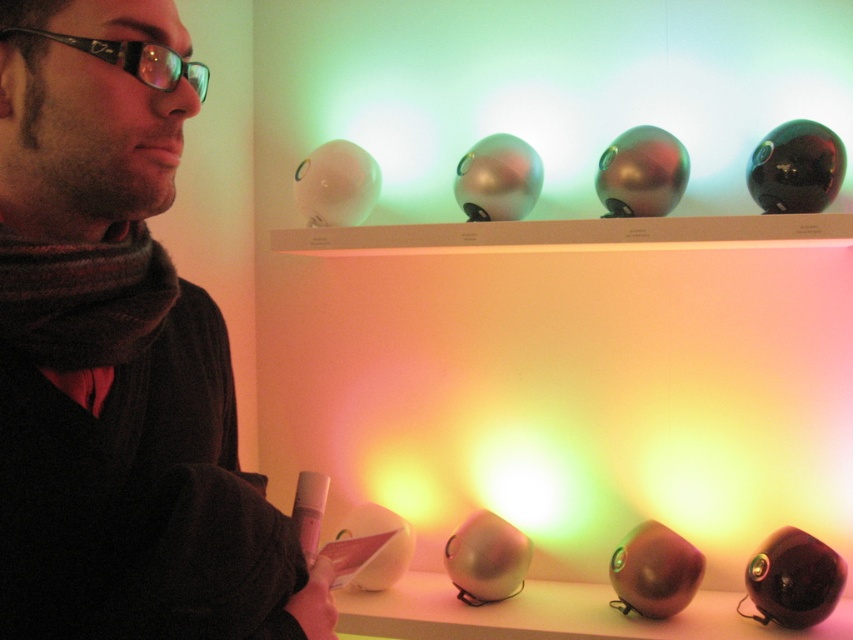
You are an artist trying to sketch the man in the image. Which object, the matte black scarf at left or the black plastic glasses at upper left, would you need to draw first if you follow the rule of drawing larger objects before smaller ones?

The matte black scarf at left is larger in size than the black plastic glasses at upper left, so you should draw the matte black scarf at left first.

You are an artist trying to sketch the scene. You need to place the matte black scarf at left accurately on your canvas. According to the coordinates provided, where should you position it?

The matte black scarf at left should be positioned at coordinates point (119, 355) on the canvas.